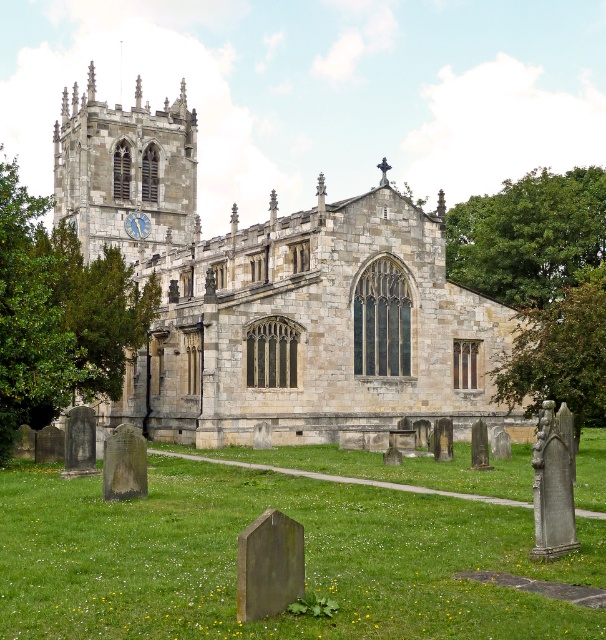
Does green leafy tree at upper right have a smaller size compared to green leafy tree at center?

Actually, green leafy tree at upper right might be larger than green leafy tree at center.

Which is in front, point (519, 298) or point (584, 300)?

Point (584, 300) is in front.

Where is `green leafy tree at upper right`? Image resolution: width=606 pixels, height=640 pixels. green leafy tree at upper right is located at coordinates (530, 236).

Can you confirm if green grass at lower center is wider than green leafy tree at upper right?

Yes, green grass at lower center is wider than green leafy tree at upper right.

Which is in front, point (93, 634) or point (511, 260)?

Positioned in front is point (93, 634).

Identify the location of green grass at lower center. point(304,556).

Is stone church at center in front of green leafy tree at upper right?

Yes.

Can you confirm if stone church at center is positioned below green leafy tree at upper right?

Yes, stone church at center is below green leafy tree at upper right.

Is point (190, 122) farther from viewer compared to point (518, 260)?

Yes, point (190, 122) is farther from viewer.

The height and width of the screenshot is (640, 606). In order to click on stone church at center in this screenshot , I will do `click(275, 296)`.